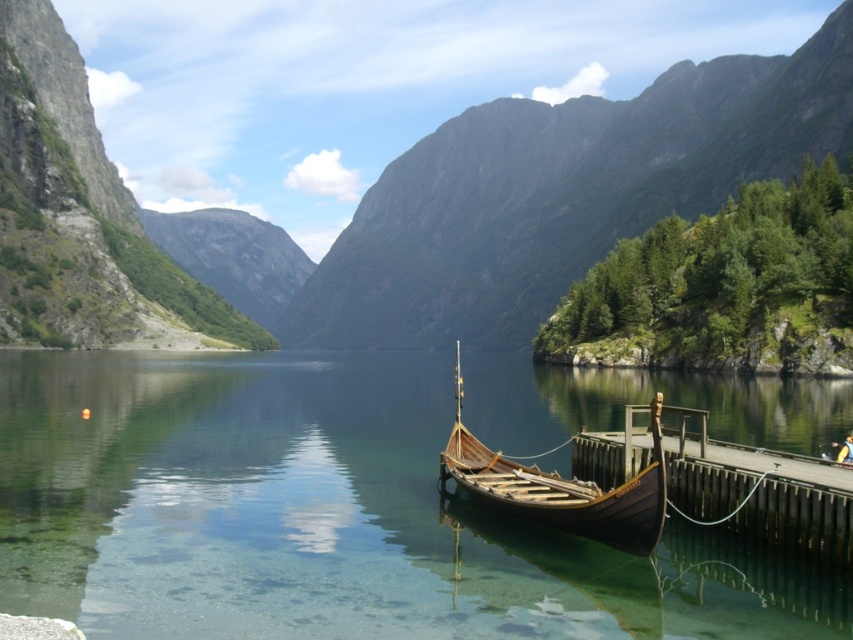
From the picture: Between rocky cliff at center and wooden viking ship at center, which one appears on the left side from the viewer's perspective?

rocky cliff at center is more to the left.

Which is more to the right, rocky cliff at center or wooden viking ship at center?

wooden viking ship at center

Describe the element at coordinates (560, 195) in the screenshot. I see `rocky cliff at center` at that location.

Locate an element on the screen. The width and height of the screenshot is (853, 640). rocky cliff at center is located at coordinates (560, 195).

Between transparent water at boat right and wooden viking ship at center, which one has less height?

wooden viking ship at center is shorter.

Consider the image. Who is more forward, (682, 554) or (643, 484)?

Point (643, 484)

The height and width of the screenshot is (640, 853). I want to click on transparent water at boat right, so (x=323, y=515).

Does brown wooden dock at lower right appear on the right side of wooden viking ship at center?

Yes, brown wooden dock at lower right is to the right of wooden viking ship at center.

Can you confirm if brown wooden dock at lower right is thinner than wooden viking ship at center?

Yes.

Where is `brown wooden dock at lower right`? The image size is (853, 640). brown wooden dock at lower right is located at coordinates (759, 490).